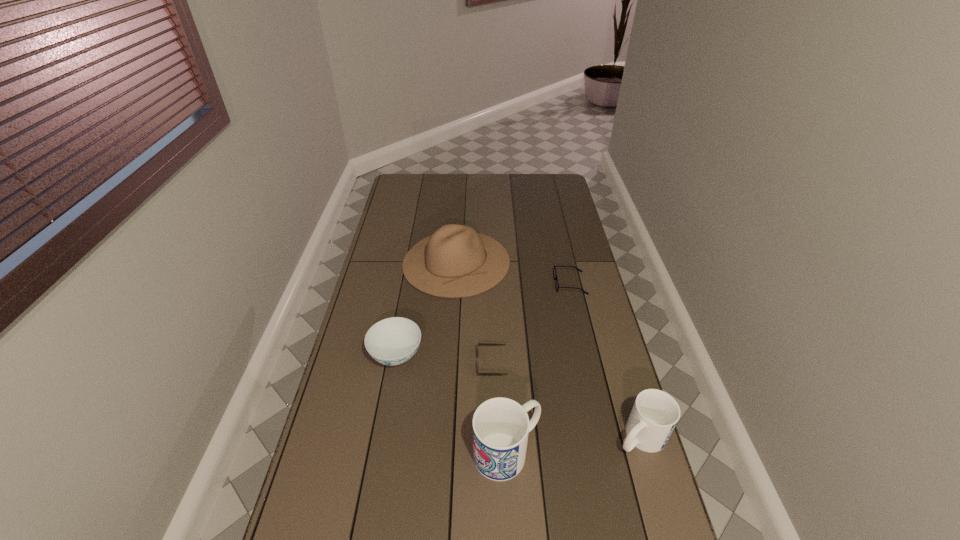
Locate an element on the screen. The height and width of the screenshot is (540, 960). the left mug is located at coordinates (501, 426).

You are a GUI agent. You are given a task and a screenshot of the screen. Output one action in this format:
    pyautogui.click(x=<x>, y=<y>)
    Task: Click on the fourth shortest object
    
    Given the screenshot: What is the action you would take?
    pyautogui.click(x=654, y=415)

This screenshot has width=960, height=540. I want to click on the right mug, so click(x=654, y=415).

At what (x,y) coordinates should I click in order to perform the action: click on sombrero. Please return your answer as a coordinate pair (x, y). Looking at the image, I should click on (455, 261).

Image resolution: width=960 pixels, height=540 pixels. I want to click on chinaware, so click(x=393, y=341).

Where is `spectacles`? spectacles is located at coordinates (555, 275).

Locate an element on the screen. This screenshot has height=540, width=960. sunglasses is located at coordinates (478, 343).

The height and width of the screenshot is (540, 960). In order to click on vacant region located 0.180m on the left of the taller mug in this screenshot , I will do `click(408, 451)`.

Where is `free location located 0.150m on the back of the fourth shortest object`? This screenshot has width=960, height=540. free location located 0.150m on the back of the fourth shortest object is located at coordinates (622, 374).

Identify the location of vacant space situated on the back of the sombrero. (461, 193).